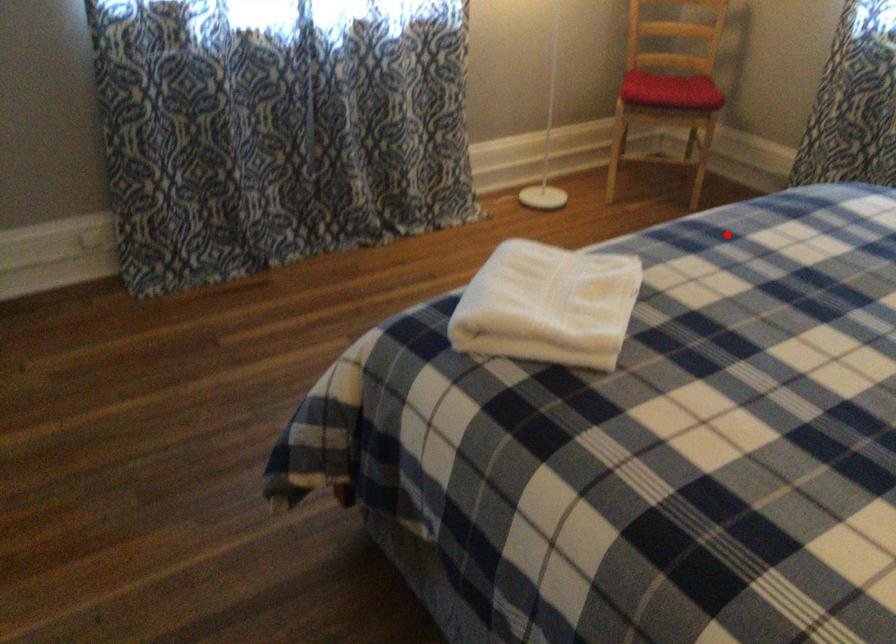
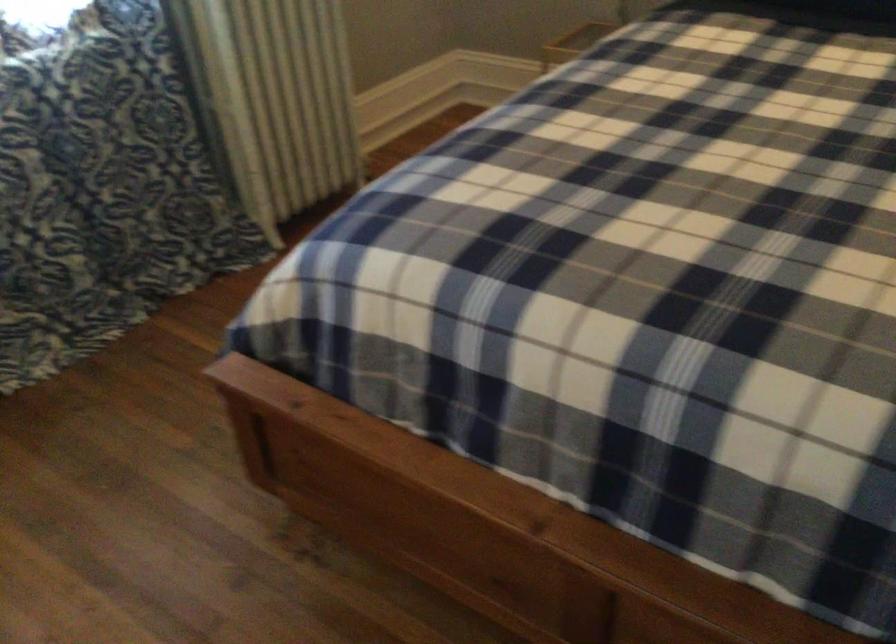
Question: A red point is marked in image1. In image2, is the corresponding 3D point closer to the camera or farther? Reply with the corresponding letter.

Choices:
 (A) The corresponding 3D point is closer.
 (B) The corresponding 3D point is farther.

Answer: (A)